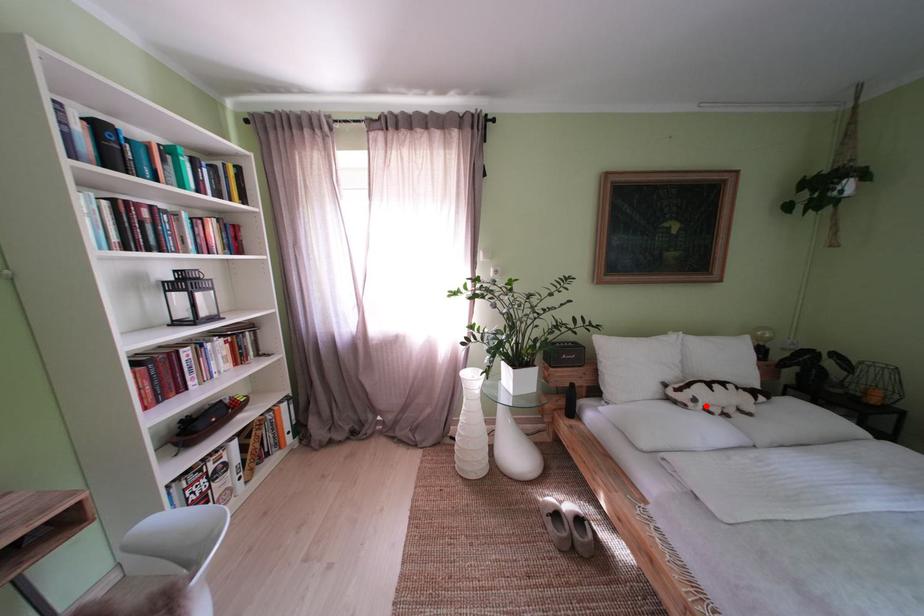
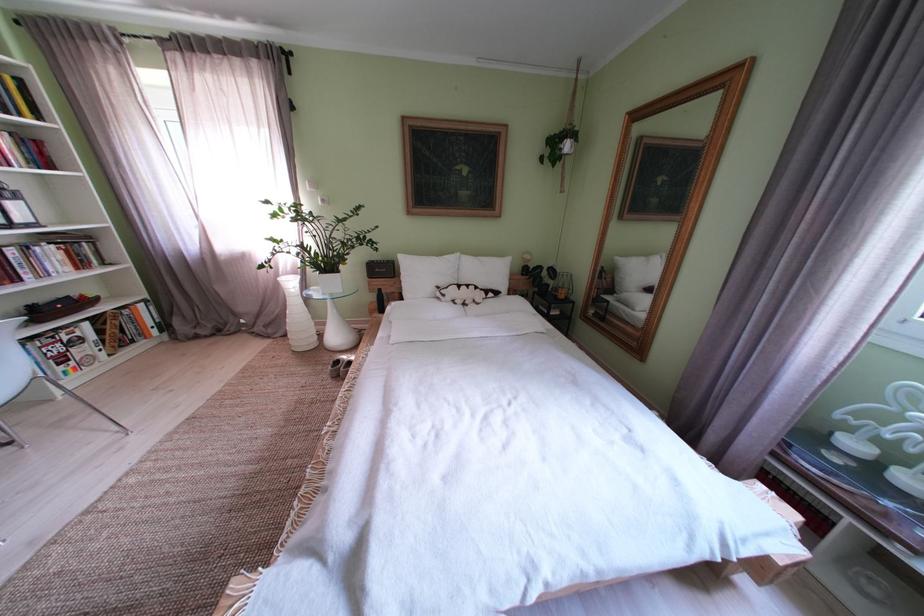
Question: A red point is marked in image1. In image2, is the corresponding 3D point closer to the camera or farther? Reply with the corresponding letter.

Choices:
 (A) The corresponding 3D point is closer.
 (B) The corresponding 3D point is farther.

Answer: (A)